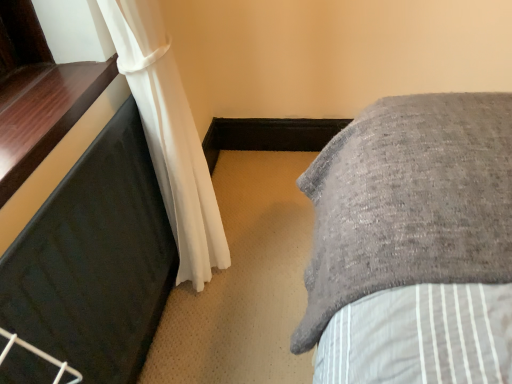
Where is `free space to the back side of white sheer curtain at left`? Image resolution: width=512 pixels, height=384 pixels. free space to the back side of white sheer curtain at left is located at coordinates (249, 183).